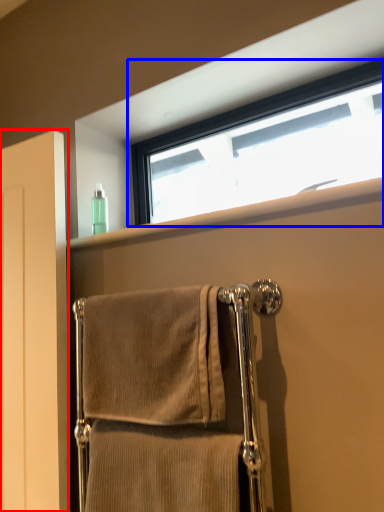
Question: Which object appears closest to the camera in this image, screen door (highlighted by a red box) or window (highlighted by a blue box)?

Choices:
 (A) screen door
 (B) window

Answer: (B)